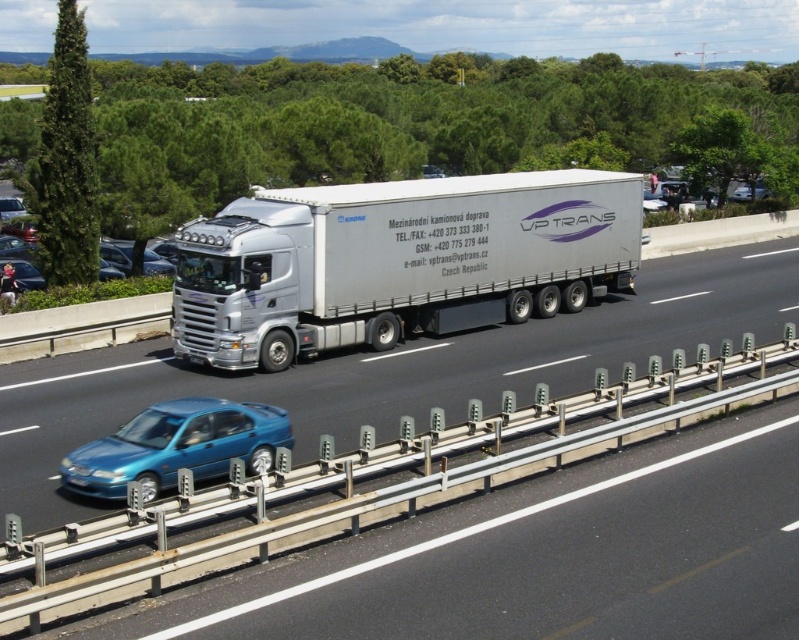
You are a driver in a car that is the same size as the metallic blue sedan at left. You want to overtake the white metallic truck at center on a highway. Considering the width of both vehicles, is it safe to attempt this maneuver in a single lane?

The white metallic truck at center is wider than the metallic blue sedan at left. Since the truck is wider, overtaking in a single lane may be unsafe due to the risk of collision. It is advisable to wait for a dedicated passing lane or ensure there is sufficient space to safely maneuver around the truck.

You are a driver in the blue sedan on the left lane. You see the white metallic trailer truck at center and the white metallic truck at center on the highway. Which one can you overtake by moving to the right lane?

The white metallic trailer truck at center is smaller than the white metallic truck at center, so you can overtake the white metallic trailer truck at center by moving to the right lane.